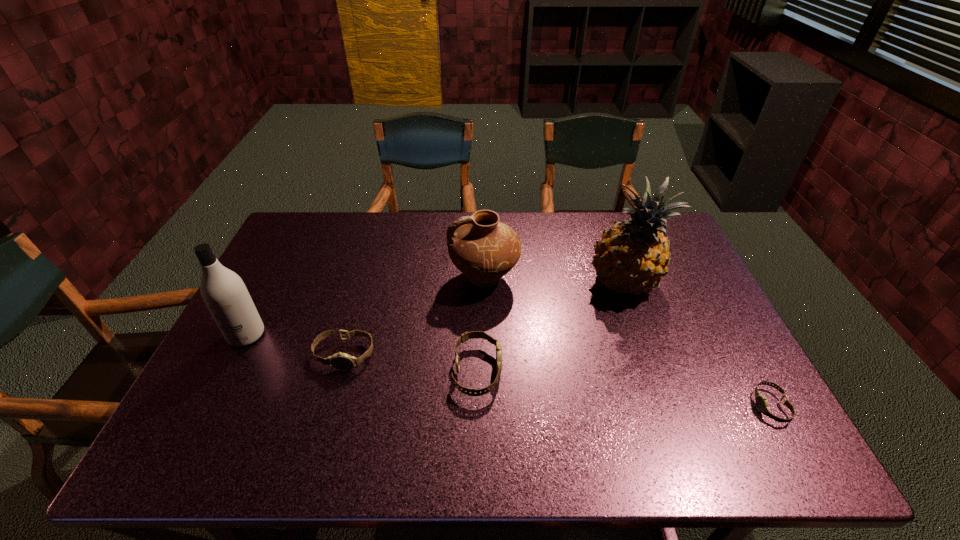
Locate an element on the screen. the second shortest object is located at coordinates (341, 361).

At what (x,y) coordinates should I click in order to perform the action: click on the second tallest watch. Please return your answer as a coordinate pair (x, y). The image size is (960, 540). Looking at the image, I should click on (341, 361).

I want to click on the second watch from left to right, so click(465, 336).

Identify the location of the rightmost object. This screenshot has width=960, height=540. (761, 401).

Find the location of a particular element. the shortest object is located at coordinates (761, 401).

Locate an element on the screen. the third tallest object is located at coordinates (484, 249).

Find the location of a particular element. Image resolution: width=960 pixels, height=540 pixels. shampoo is located at coordinates (225, 295).

Find the location of a particular element. The height and width of the screenshot is (540, 960). the second tallest object is located at coordinates (225, 295).

Where is `pineapple`? pineapple is located at coordinates (632, 256).

The width and height of the screenshot is (960, 540). Identify the location of vacant area situated on the face of the leftmost watch. (329, 411).